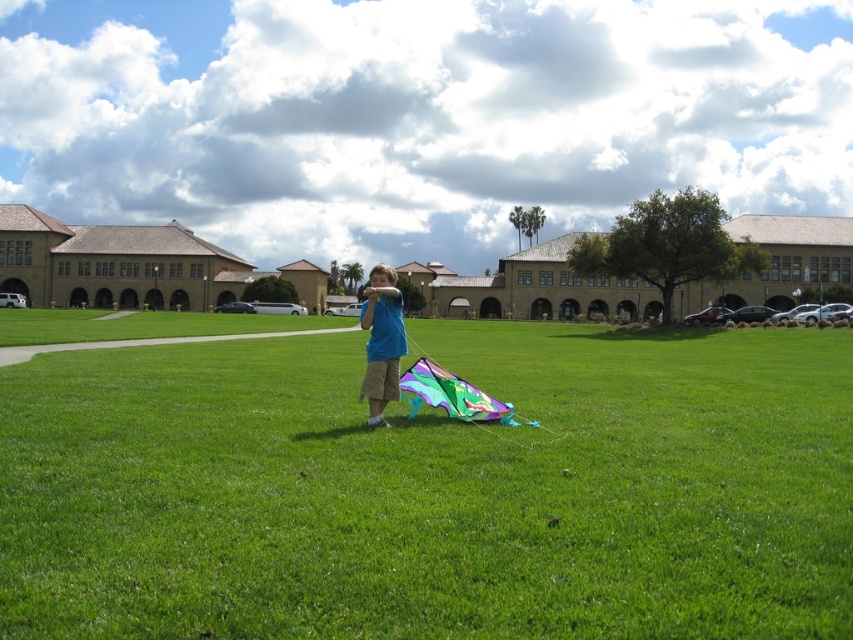
Question: Which point is closer to the camera?

Choices:
 (A) multicolored kite at center
 (B) blue cotton shirt at center

Answer: (A)

Question: Is multicolored kite at center wider than multicolored fabric kite at center?

Choices:
 (A) yes
 (B) no

Answer: (A)

Question: Where is multicolored kite at center located in relation to multicolored fabric kite at center in the image?

Choices:
 (A) right
 (B) left

Answer: (A)

Question: Considering the real-world distances, which object is farthest from the multicolored fabric kite at center?

Choices:
 (A) blue cotton shirt at center
 (B) multicolored kite at center

Answer: (B)

Question: Which point is farther from the camera taking this photo?

Choices:
 (A) 119,374
 (B) 370,275
 (C) 439,401

Answer: (A)

Question: Is blue cotton shirt at center thinner than multicolored fabric kite at center?

Choices:
 (A) no
 (B) yes

Answer: (A)